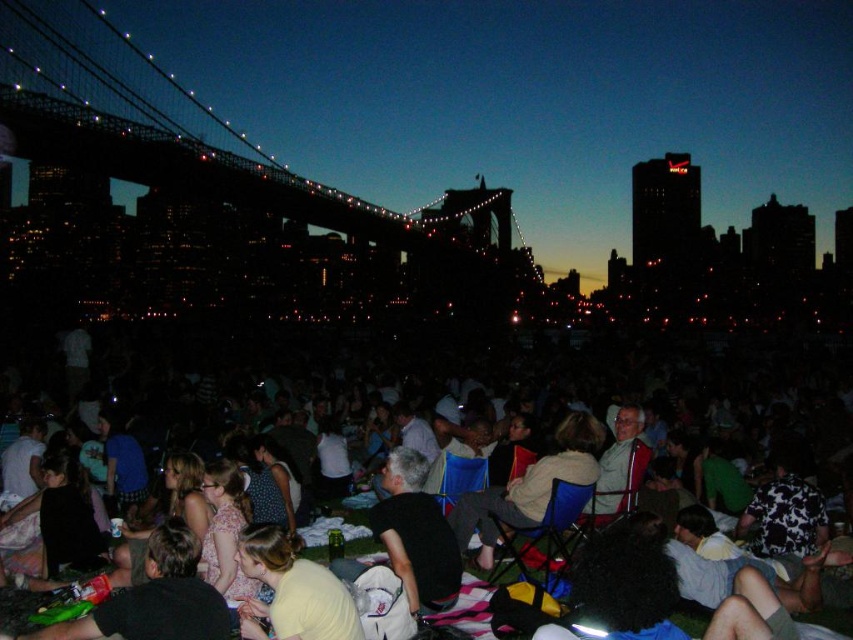
Is matte black chairs at center to the left of yellow cotton shirt at center from the viewer's perspective?

Incorrect, matte black chairs at center is not on the left side of yellow cotton shirt at center.

Between matte black chairs at center and yellow cotton shirt at center, which one has more height?

Standing taller between the two is matte black chairs at center.

Which is behind, point (842, 509) or point (273, 628)?

Positioned behind is point (842, 509).

This screenshot has width=853, height=640. In order to click on matte black chairs at center in this screenshot , I will do `click(703, 385)`.

Who is shorter, silhouette steel bridge at upper left or yellow cotton shirt at center?

yellow cotton shirt at center

Is point (283, 195) behind point (280, 577)?

Yes, point (283, 195) is behind point (280, 577).

Identify the location of silhouette steel bridge at upper left. Image resolution: width=853 pixels, height=640 pixels. click(x=219, y=148).

Can you confirm if yellow cotton shirt at center is positioned to the left of light brown fabric jacket at center?

Indeed, yellow cotton shirt at center is positioned on the left side of light brown fabric jacket at center.

Who is positioned more to the left, yellow cotton shirt at center or light brown fabric jacket at center?

→ Positioned to the left is yellow cotton shirt at center.

Does point (292, 592) come closer to viewer compared to point (486, 513)?

Yes, it is.

Find the location of a particular element. The image size is (853, 640). yellow cotton shirt at center is located at coordinates (292, 592).